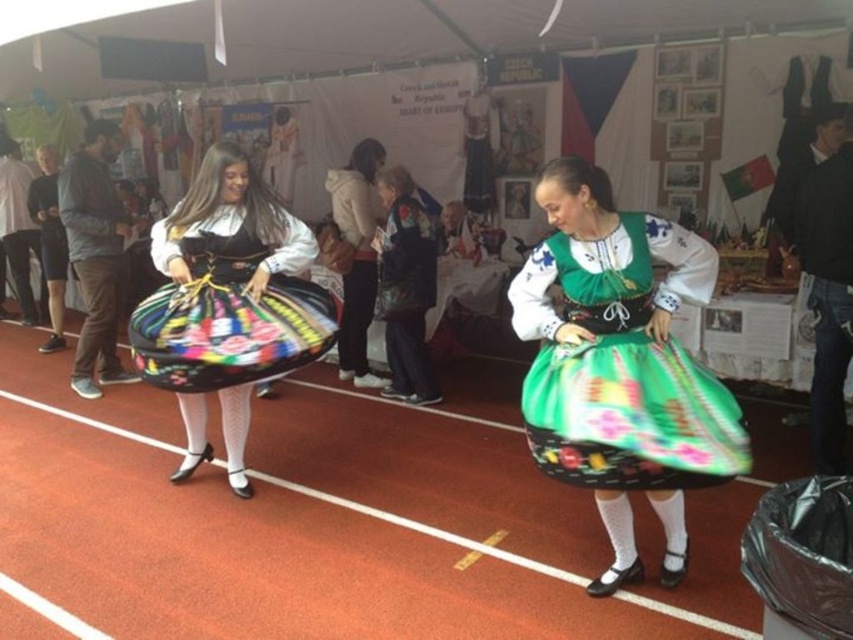
Question: Which object appears farthest from the camera in this image?

Choices:
 (A) green satin dress at center
 (B) multicolored fabric skirt at center
 (C) white cotton hoodie at center

Answer: (C)

Question: Does multicolored fabric skirt at center appear over white cotton hoodie at center?

Choices:
 (A) no
 (B) yes

Answer: (A)

Question: Does green satin dress at center appear under multicolored fabric skirt at center?

Choices:
 (A) no
 (B) yes

Answer: (B)

Question: Is multicolored fabric skirt at center thinner than white cotton hoodie at center?

Choices:
 (A) yes
 (B) no

Answer: (B)

Question: Among these objects, which one is nearest to the camera?

Choices:
 (A) white cotton hoodie at center
 (B) green satin dress at center
 (C) multicolored fabric skirt at center

Answer: (B)

Question: Among these points, which one is nearest to the camera?

Choices:
 (A) (219, 195)
 (B) (515, 317)
 (C) (363, 220)

Answer: (B)